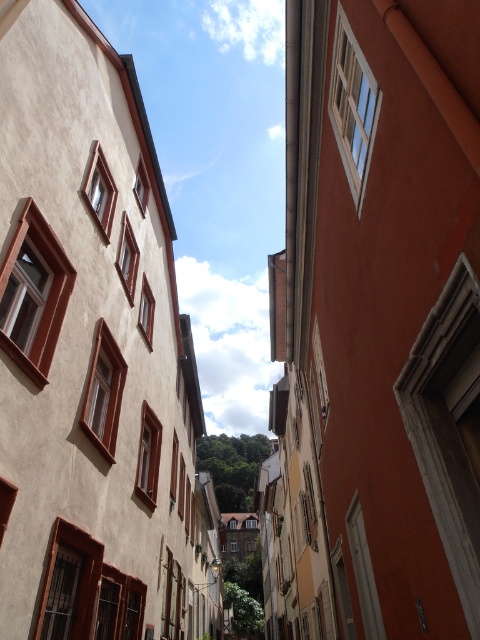
The image size is (480, 640). What do you see at coordinates (376, 326) in the screenshot?
I see `smooth orange wall at right` at bounding box center [376, 326].

Is smooth orange wall at right wider than smooth beige building at left?

Yes.

Between point (319, 296) and point (4, 390), which one is positioned behind?

Point (319, 296)

The height and width of the screenshot is (640, 480). I want to click on smooth orange wall at right, so click(376, 326).